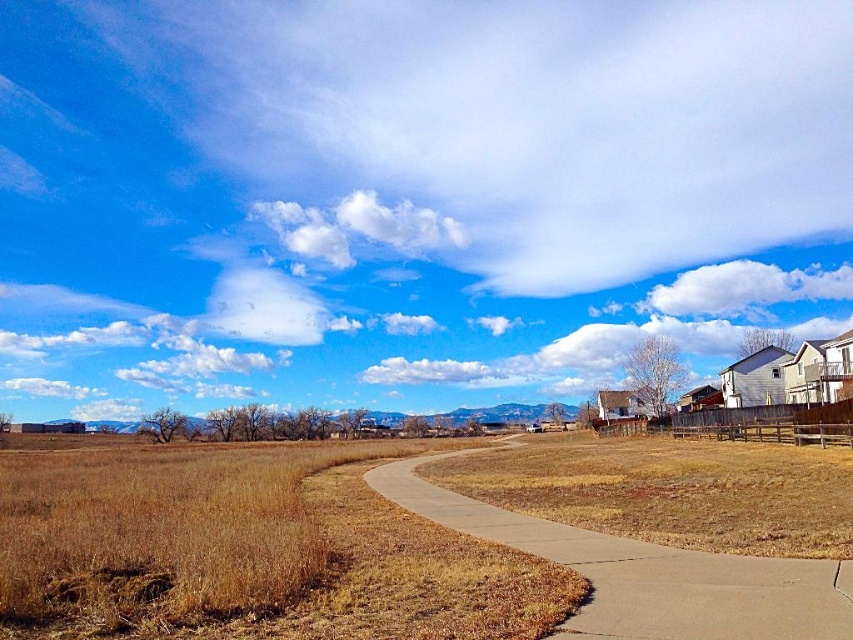
You are a bird flying at the same altitude as the smooth concrete path at center. Can you fly over the white fluffy cloud at upper center without changing your flight path?

The smooth concrete path at center has a lesser height compared to white fluffy cloud at upper center. Since the cloud is higher, the bird cannot fly over it without ascending.

Looking at this image, you are a gardener planning to install a new sprinkler system along the smooth concrete path at center. Considering the position of the white fluffy cloud at upper center, where should you place the sprinkler heads to ensure they are not directly under the cloud?

The smooth concrete path at center is positioned under the white fluffy cloud at upper center. To avoid placing sprinkler heads directly under the cloud, you should position them away from the area of the path that lies directly beneath the cloud.

You are planning to take a photo of the sky with both the white fluffy cloud at upper center and the white fluffy cloud at upper right in the frame. Which cloud should you focus on to ensure both are visible without zooming in or out?

You should focus on the white fluffy cloud at upper right because it is larger in size compared to the white fluffy cloud at upper center, ensuring both can fit within the frame without needing to adjust the zoom.